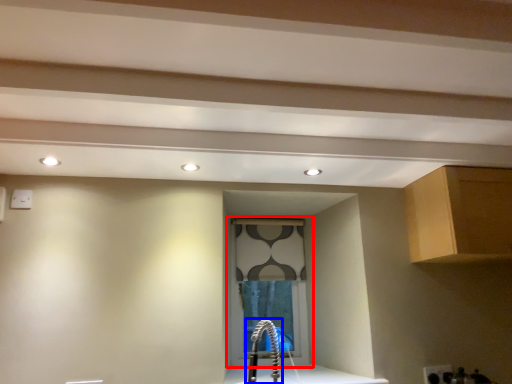
Question: Which of the following is the farthest to the observer, window (highlighted by a red box) or faucet (highlighted by a blue box)?

Choices:
 (A) window
 (B) faucet

Answer: (A)